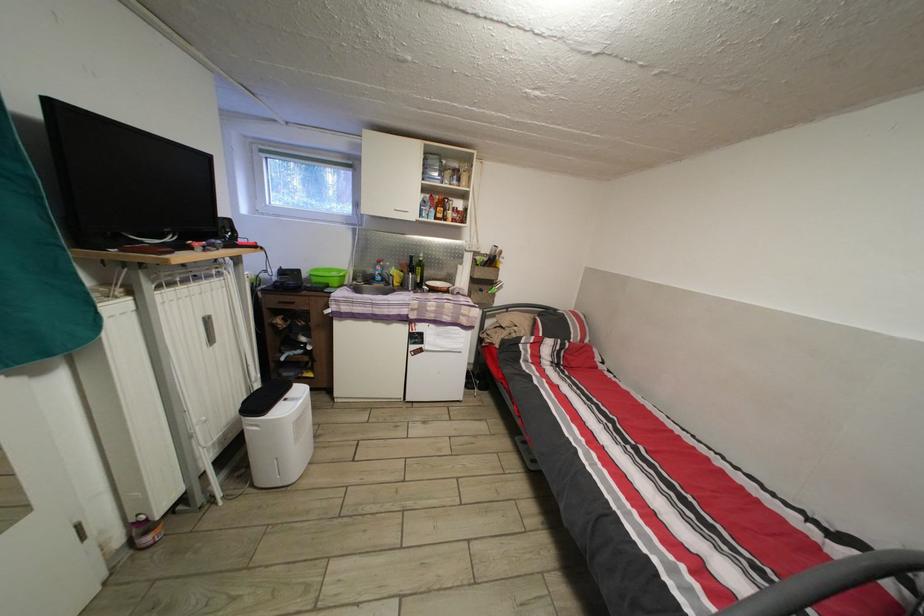
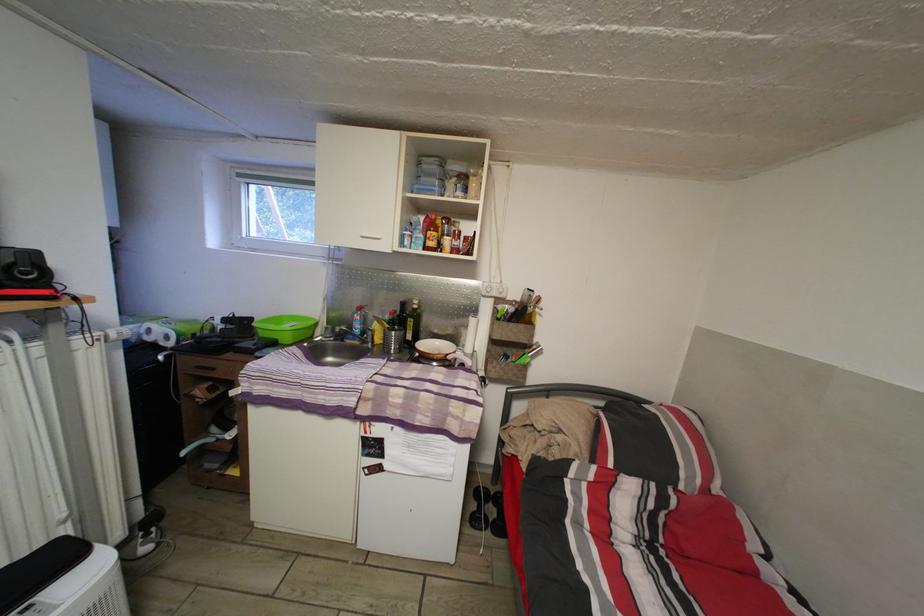
The point at (306,277) is marked in the first image. Where is the corresponding point in the second image?

(257, 326)